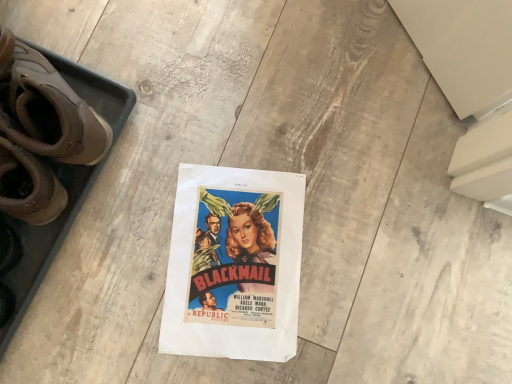
Question: Is brown leather boots at left to the left or to the right of matte paper poster at center in the image?

Choices:
 (A) right
 (B) left

Answer: (B)

Question: In terms of height, does brown leather boots at left look taller or shorter compared to matte paper poster at center?

Choices:
 (A) short
 (B) tall

Answer: (B)

Question: Is brown leather boots at left wider or thinner than matte paper poster at center?

Choices:
 (A) thin
 (B) wide

Answer: (A)

Question: Considering the positions of matte paper poster at center and brown leather boots at left in the image, is matte paper poster at center wider or thinner than brown leather boots at left?

Choices:
 (A) wide
 (B) thin

Answer: (A)

Question: Relative to brown leather boots at left, is matte paper poster at center in front or behind?

Choices:
 (A) front
 (B) behind

Answer: (B)

Question: Considering the positions of point (218, 289) and point (44, 82), is point (218, 289) closer or farther from the camera than point (44, 82)?

Choices:
 (A) closer
 (B) farther

Answer: (B)

Question: Based on their sizes in the image, would you say matte paper poster at center is bigger or smaller than brown leather boots at left?

Choices:
 (A) big
 (B) small

Answer: (B)